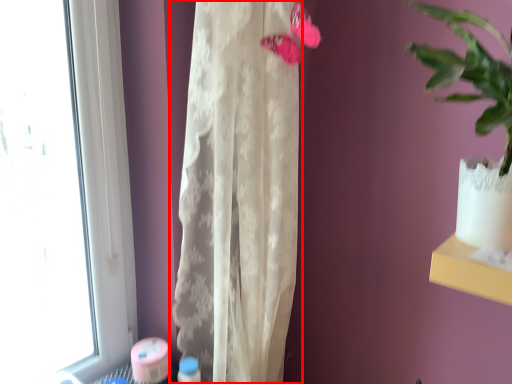
Question: From the image, what is the correct spatial relationship of curtain (annotated by the red box) in relation to flower?

Choices:
 (A) left
 (B) right

Answer: (A)